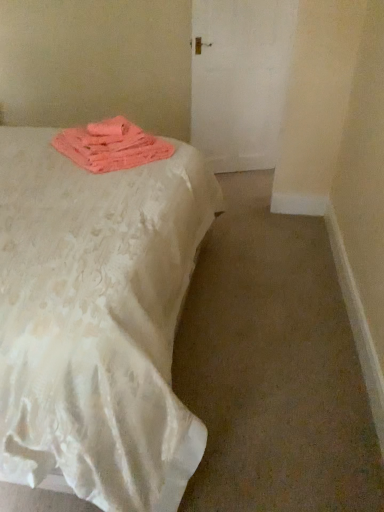
Question: From a real-world perspective, is pink fabric at upper left above or below white textured bed at left?

Choices:
 (A) above
 (B) below

Answer: (A)

Question: Based on their sizes in the image, would you say pink fabric at upper left is bigger or smaller than white textured bed at left?

Choices:
 (A) big
 (B) small

Answer: (B)

Question: Is pink fabric at upper left inside the boundaries of white textured bed at left, or outside?

Choices:
 (A) outside
 (B) inside

Answer: (B)

Question: Based on their sizes in the image, would you say white textured bed at left is bigger or smaller than pink fabric at upper left?

Choices:
 (A) small
 (B) big

Answer: (B)

Question: Relative to pink fabric at upper left, is white textured bed at left in front or behind?

Choices:
 (A) front
 (B) behind

Answer: (A)

Question: From the image's perspective, is white textured bed at left located above or below pink fabric at upper left?

Choices:
 (A) below
 (B) above

Answer: (A)

Question: Considering the relative positions of white textured bed at left and pink fabric at upper left in the image provided, is white textured bed at left to the left or to the right of pink fabric at upper left?

Choices:
 (A) left
 (B) right

Answer: (A)